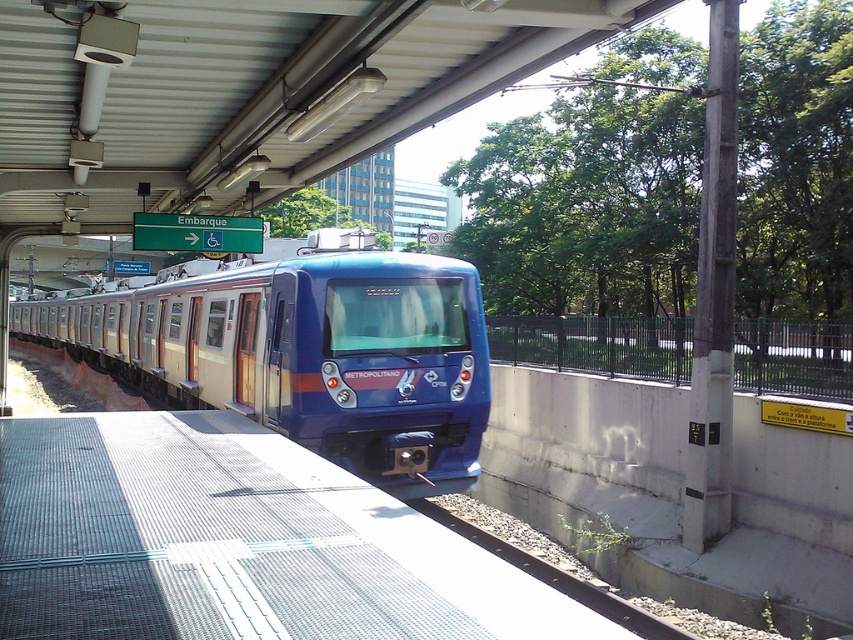
Question: Which point is farther to the camera?

Choices:
 (A) rusty metal train track at lower center
 (B) blue metallic train at center

Answer: (B)

Question: Can you confirm if blue metallic train at center is thinner than rusty metal train track at lower center?

Choices:
 (A) yes
 (B) no

Answer: (B)

Question: Which point is farther to the camera?

Choices:
 (A) (112, 348)
 (B) (531, 576)

Answer: (A)

Question: Can you confirm if blue metallic train at center is thinner than rusty metal train track at lower center?

Choices:
 (A) no
 (B) yes

Answer: (A)

Question: Is blue metallic train at center thinner than rusty metal train track at lower center?

Choices:
 (A) no
 (B) yes

Answer: (A)